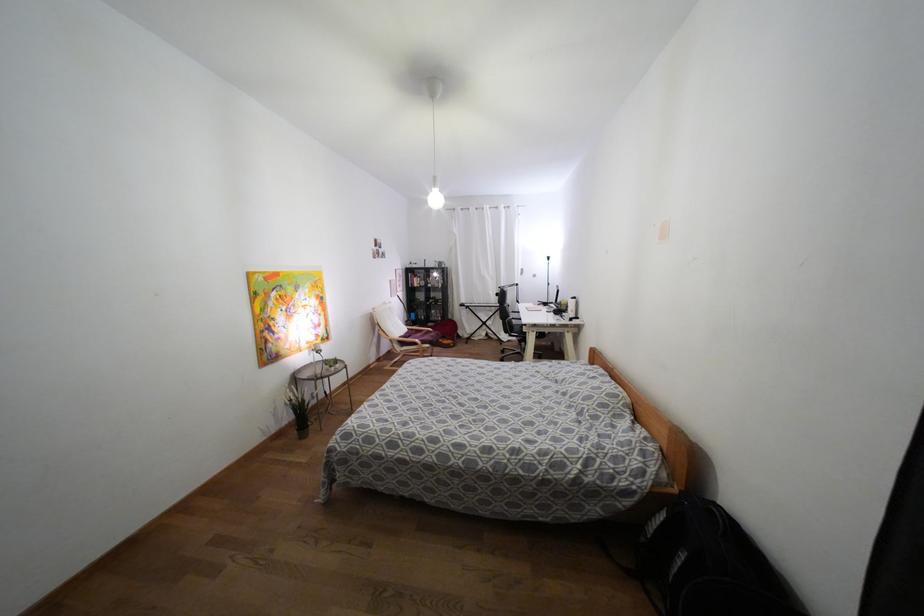
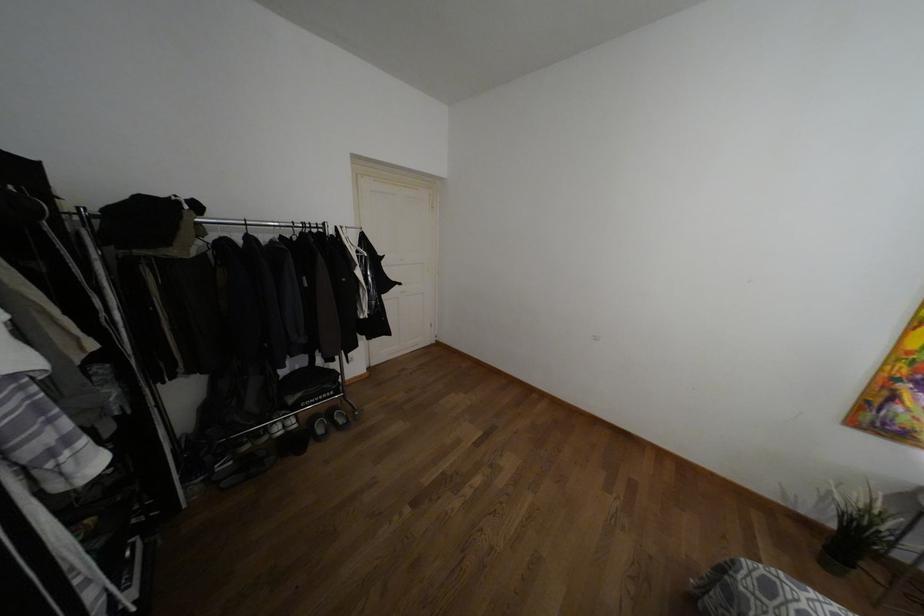
Locate, in the second image, the point that corresponds to point (346, 436) in the first image.

(769, 588)